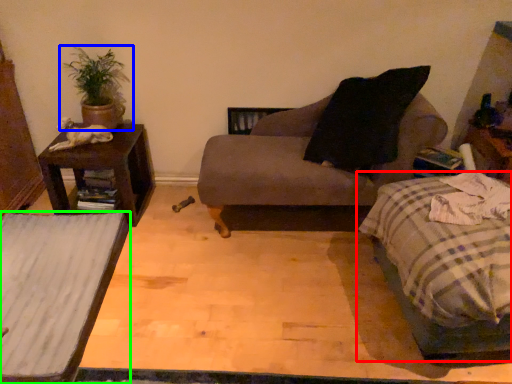
Question: Considering the real-world distances, which object is farthest from bed (highlighted by a red box)? houseplant (highlighted by a blue box) or table (highlighted by a green box)?

Choices:
 (A) houseplant
 (B) table

Answer: (A)